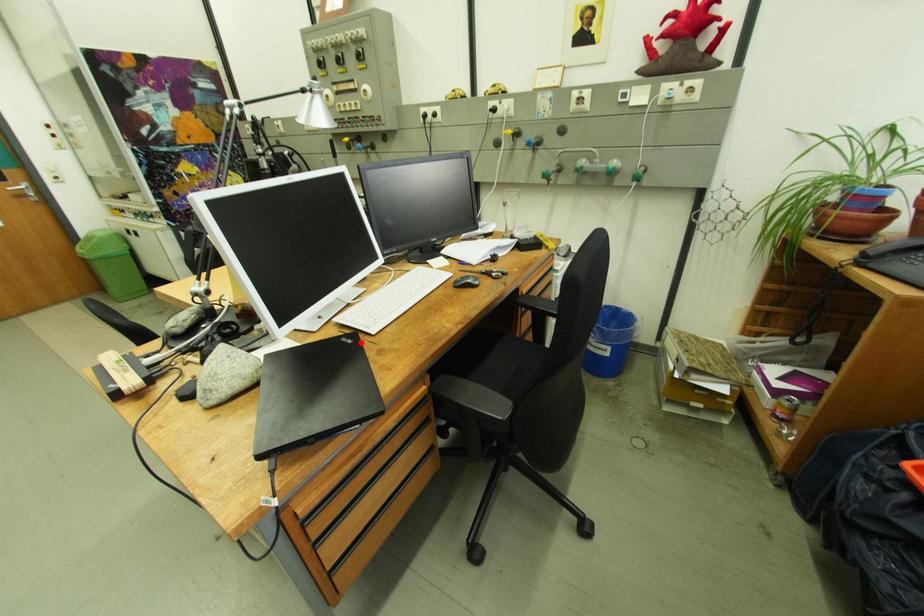
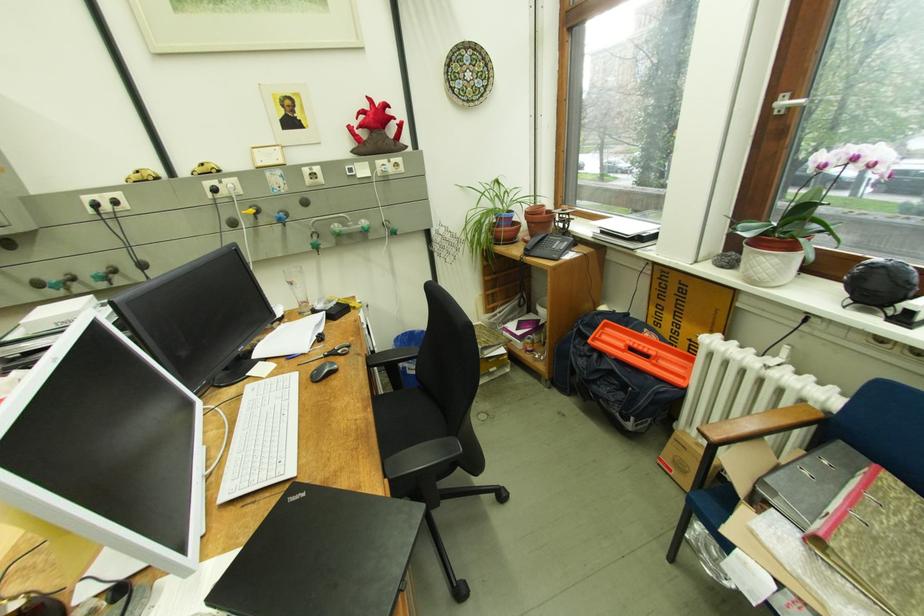
In the second image, find the point that corresponds to the highlighted location in the first image.

(312, 496)